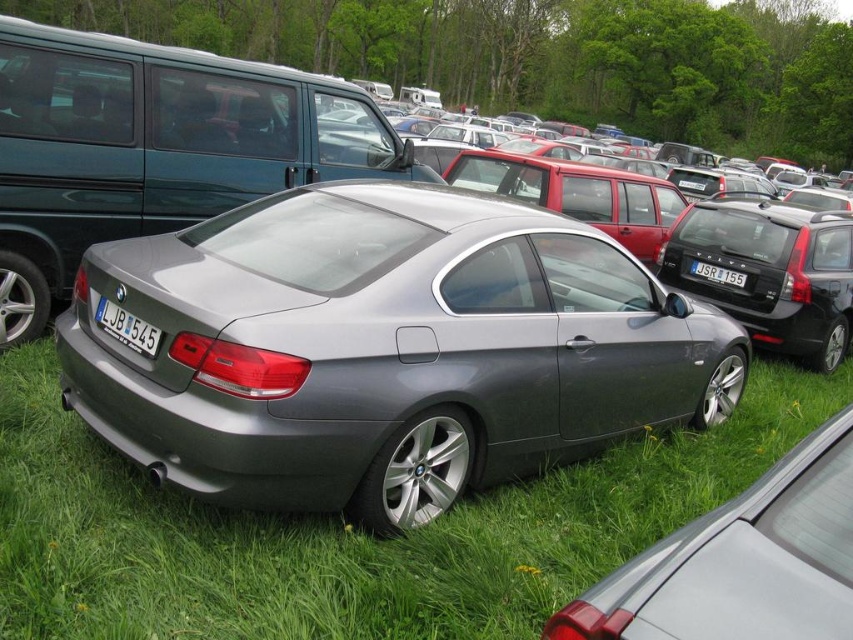
Who is higher up, satin black sedan at center or white plastic license plate at center?

satin black sedan at center is higher up.

Is satin black sedan at center thinner than white plastic license plate at center?

No.

Locate an element on the screen. This screenshot has width=853, height=640. satin black sedan at center is located at coordinates (770, 273).

From the picture: Who is positioned more to the left, satin metallic car at center or white plastic license plate at center?

white plastic license plate at center

Is point (448, 369) positioned in front of point (144, 321)?

No.

Find the location of a particular element. The height and width of the screenshot is (640, 853). satin metallic car at center is located at coordinates (383, 348).

Does white plastic license plate at center have a larger size compared to black plastic license plate at center?

No.

The image size is (853, 640). I want to click on white plastic license plate at center, so click(126, 326).

The height and width of the screenshot is (640, 853). What do you see at coordinates (126, 326) in the screenshot?
I see `white plastic license plate at center` at bounding box center [126, 326].

This screenshot has height=640, width=853. Find the location of `white plastic license plate at center`. white plastic license plate at center is located at coordinates (126, 326).